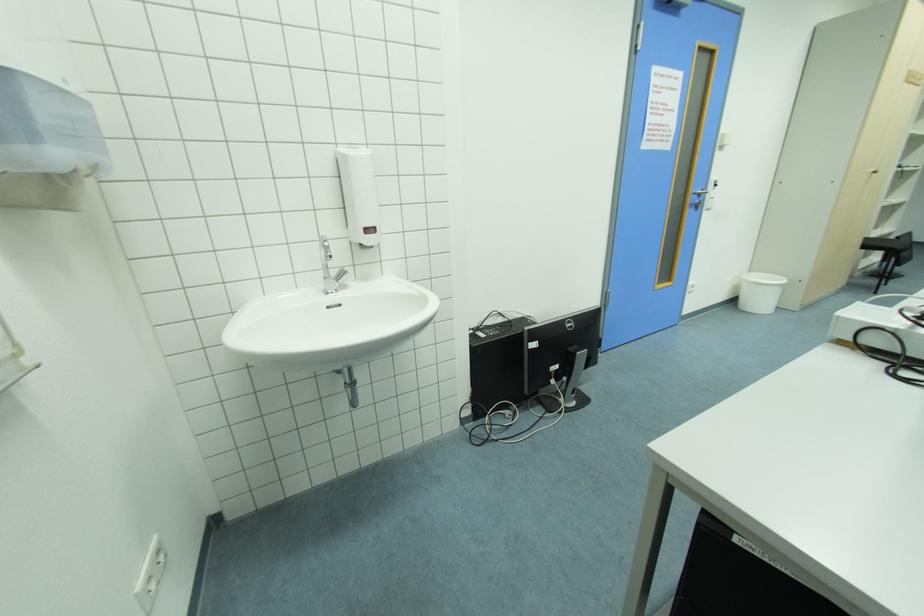
The height and width of the screenshot is (616, 924). What are the coordinates of `white power outlet` in the screenshot? It's located at (150, 575).